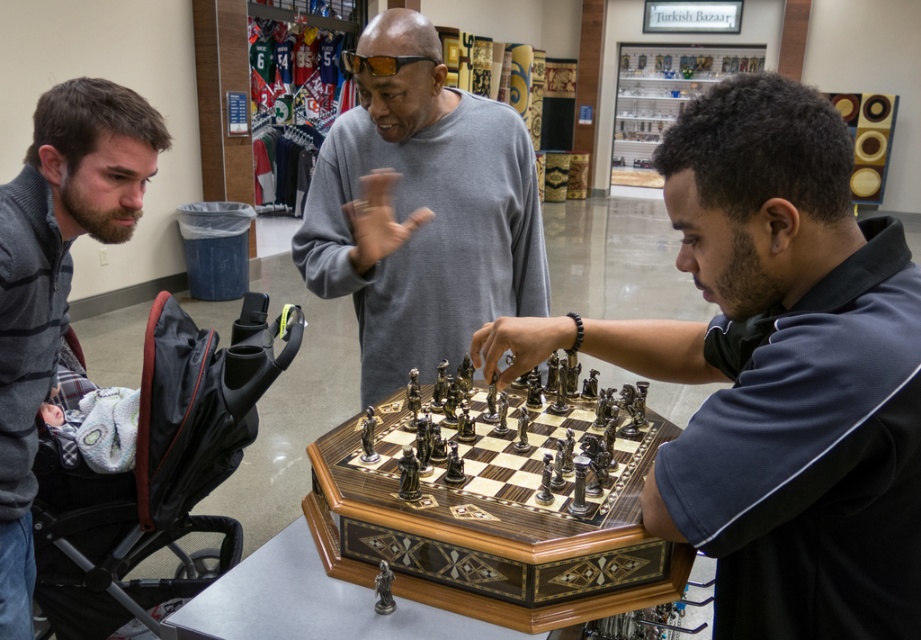
Where is `gray sweater at center`? The image size is (921, 640). gray sweater at center is located at coordinates (420, 209).

Can you confirm if gray sweater at center is bigger than wooden chess set at center?

Yes, gray sweater at center is bigger than wooden chess set at center.

From the picture: Who is more distant from viewer, (416, 92) or (546, 605)?

Point (416, 92)

Image resolution: width=921 pixels, height=640 pixels. What are the coordinates of `gray sweater at center` in the screenshot? It's located at (420, 209).

Based on the photo, is metallic chess pieces at center thinner than gray sweater at center?

Correct, metallic chess pieces at center's width is less than gray sweater at center's.

Which is below, metallic chess pieces at center or gray sweater at center?

Positioned lower is metallic chess pieces at center.

What do you see at coordinates (776, 372) in the screenshot? The width and height of the screenshot is (921, 640). I see `metallic chess pieces at center` at bounding box center [776, 372].

At what (x,y) coordinates should I click in order to perform the action: click on metallic chess pieces at center. Please return your answer as a coordinate pair (x, y). Looking at the image, I should click on (776, 372).

Does metallic chess pieces at center lie behind gray sweater at left?

No, it is not.

Can you confirm if metallic chess pieces at center is positioned to the left of gray sweater at left?

No, metallic chess pieces at center is not to the left of gray sweater at left.

What do you see at coordinates (776, 372) in the screenshot?
I see `metallic chess pieces at center` at bounding box center [776, 372].

Locate an element on the screen. This screenshot has height=640, width=921. metallic chess pieces at center is located at coordinates (776, 372).